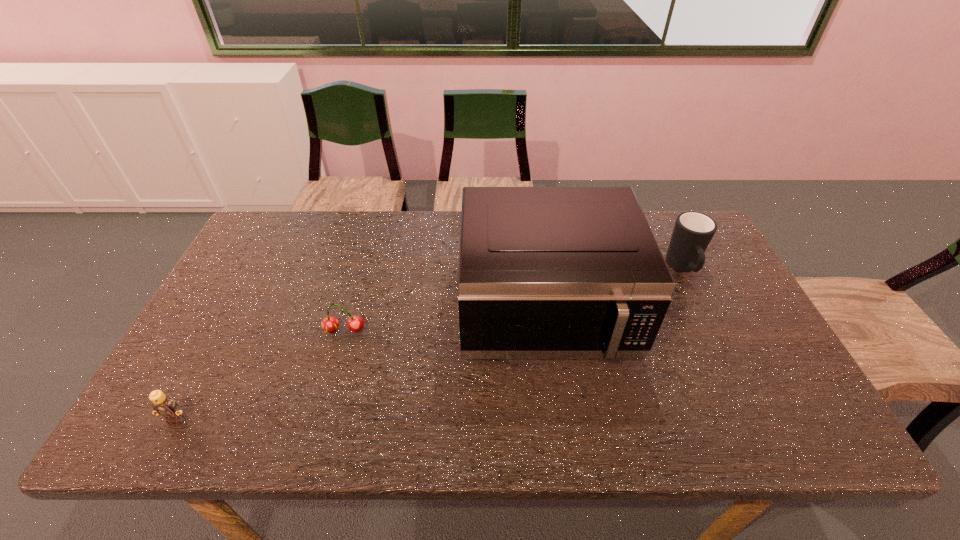
Where is `object at the far edge`? object at the far edge is located at coordinates (693, 231).

Locate an element on the screen. object located at the near edge is located at coordinates (164, 405).

The height and width of the screenshot is (540, 960). Find the location of `object located in the left edge section of the desktop`. object located in the left edge section of the desktop is located at coordinates (164, 405).

Locate an element on the screen. object that is at the right edge is located at coordinates (693, 231).

What are the coordinates of `object at the near left corner` in the screenshot? It's located at (164, 405).

Find the location of a particular element. The width and height of the screenshot is (960, 540). object at the far right corner is located at coordinates (693, 231).

In the image, there is a desktop. Where is `vacant space at the far edge`? This screenshot has width=960, height=540. vacant space at the far edge is located at coordinates (434, 255).

In the image, there is a desktop. Where is `vacant space at the near edge`? Image resolution: width=960 pixels, height=540 pixels. vacant space at the near edge is located at coordinates (371, 420).

At what (x,y) coordinates should I click in order to perform the action: click on vacant region at the right edge of the desktop. Please return your answer as a coordinate pair (x, y). Looking at the image, I should click on (693, 287).

Find the location of `vacant space at the far left corner`. vacant space at the far left corner is located at coordinates (258, 244).